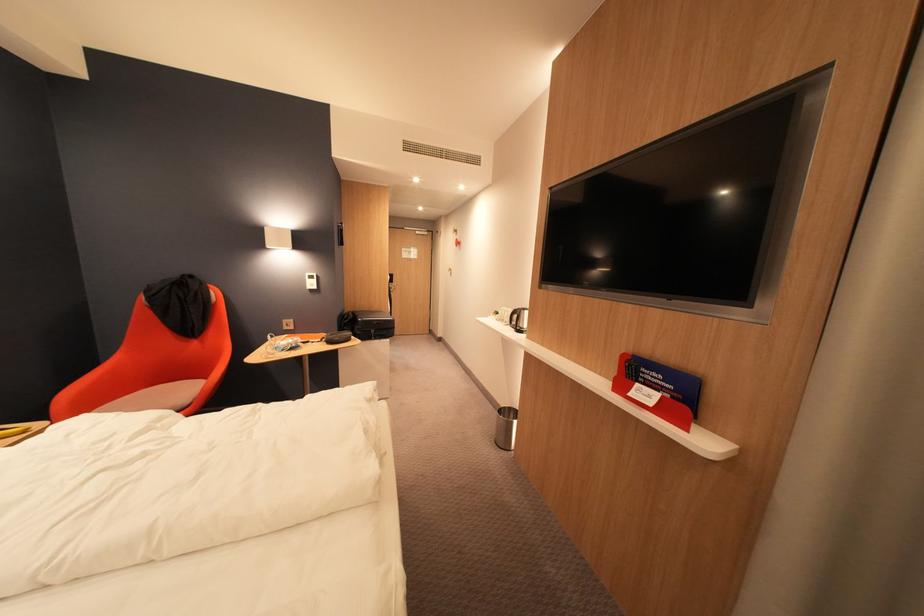
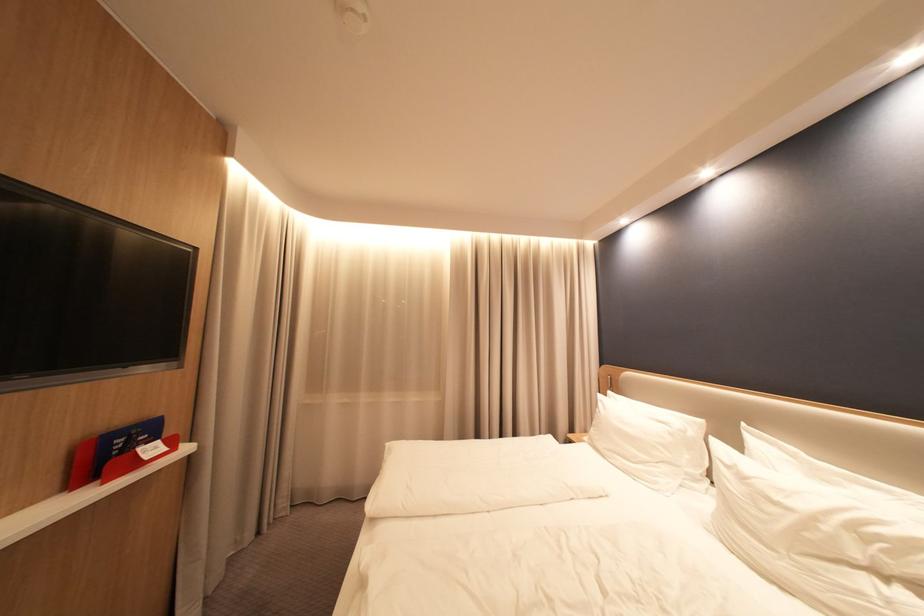
Find the pixel in the second image that matches (x=648, y=386) in the first image.

(150, 452)